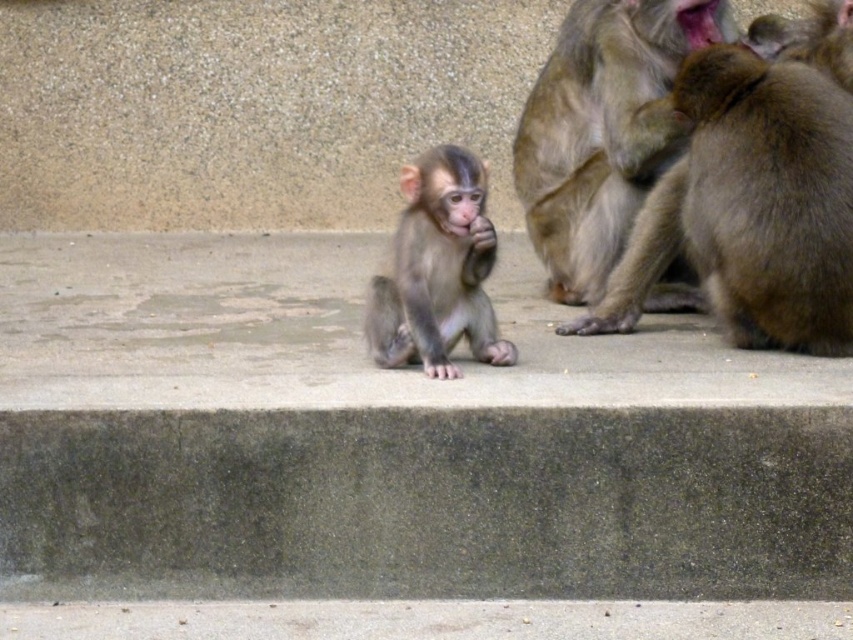
Question: Which point appears closest to the camera in this image?

Choices:
 (A) (260, 330)
 (B) (613, 228)

Answer: (A)

Question: Does brown furry monkey at right appear on the right side of brown furry monkey at upper right?

Choices:
 (A) yes
 (B) no

Answer: (B)

Question: In this image, where is brown furry monkey at right located relative to brown furry monkey at upper right?

Choices:
 (A) right
 (B) left

Answer: (B)

Question: Estimate the real-world distances between objects in this image. Which object is farther from the brown furry monkey at upper right?

Choices:
 (A) concrete ledge at center
 (B) light brown fur monkey at center
 (C) brown furry monkey at right

Answer: (A)

Question: Can you confirm if light brown fur monkey at center is bigger than brown furry monkey at upper right?

Choices:
 (A) yes
 (B) no

Answer: (A)

Question: Estimate the real-world distances between objects in this image. Which object is closer to the brown furry monkey at right?

Choices:
 (A) concrete ledge at center
 (B) light brown fur monkey at center
 (C) brown furry monkey at upper right
 (D) fuzzy brown monkey at center

Answer: (D)